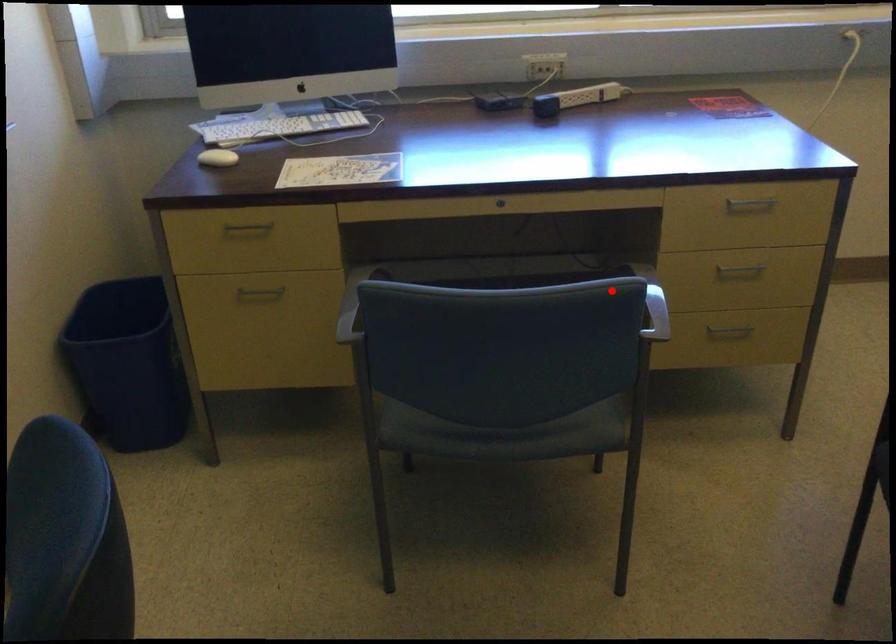
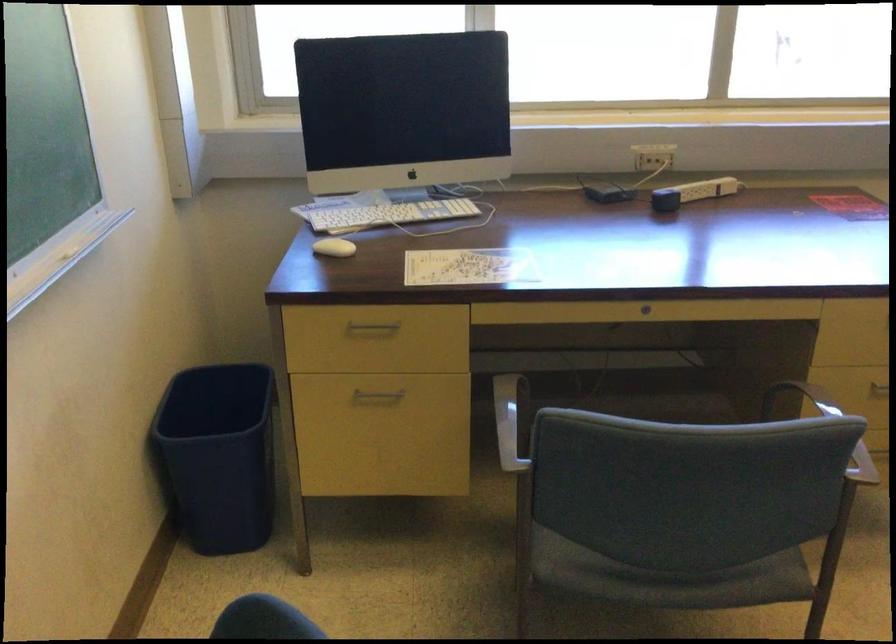
Question: I am providing you with two images of the same scene from different viewpoints. Image1 has a red point marked. In image2, the corresponding 3D location appears at what relative position? Reply with the corresponding letter.

Choices:
 (A) Closer
 (B) Farther

Answer: (A)